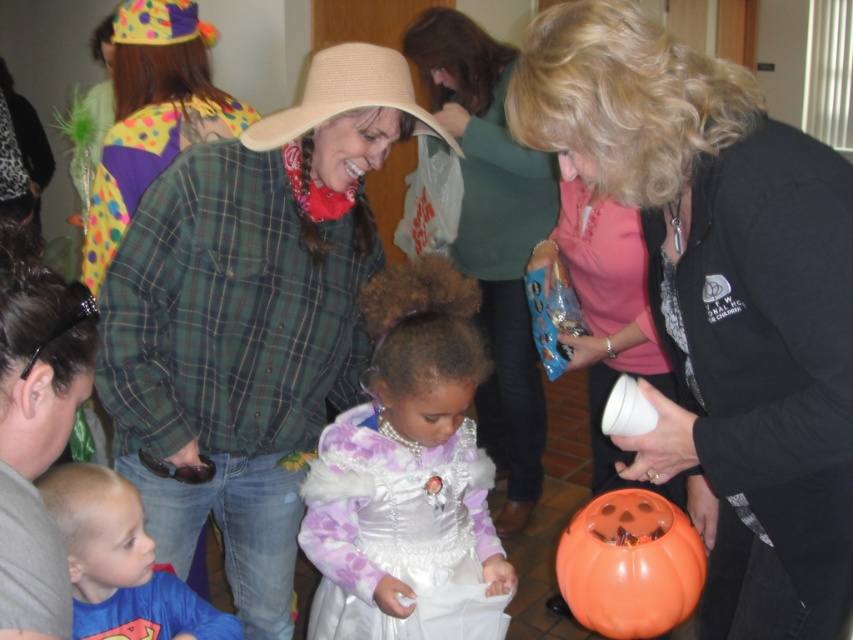
You are a photographer at this event and want to capture a photo that includes both the green plaid shirt at center and the orange matte pumpkin at lower right. Based on their positions, which object should be placed on the left side of the photo frame?

The green plaid shirt at center should be placed on the left side of the photo frame because it is positioned on the left side of the orange matte pumpkin at lower right.

You are standing at point (193, 68) and want to walk to point (404, 288). Is there a clear path between these two points?

Yes, since point (404, 288) is in front of point (193, 68), there is a clear path between them.

You are standing in the festive indoor scene and want to move from point A to point B. The coordinates for point A are point (582, 144) and point B are point (660, 627). Which point is closer to you?

Point (582, 144) is closer to the viewer than point (660, 627).